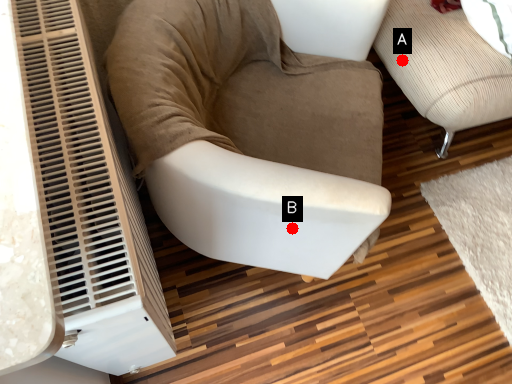
Question: Two points are circled on the image, labeled by A and B beside each circle. Which of the following is the farthest from the observer?

Choices:
 (A) A is further
 (B) B is further

Answer: (A)